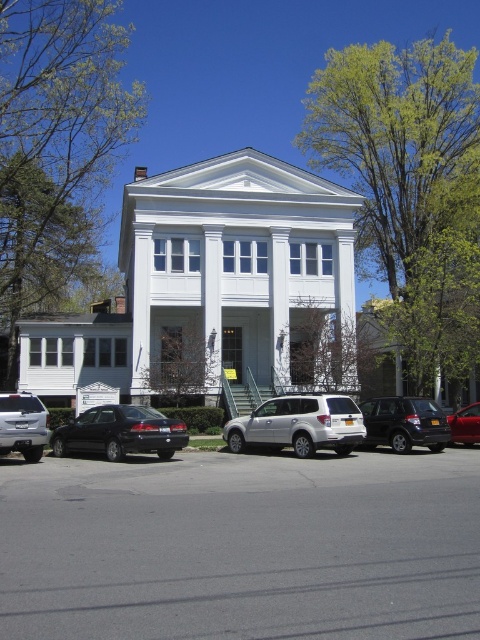
Is shiny black sedan at center above silver metallic sedan at lower left?

Incorrect, shiny black sedan at center is not positioned above silver metallic sedan at lower left.

Is shiny black sedan at center positioned before silver metallic sedan at lower left?

That is False.

Where is `shiny black sedan at center`? This screenshot has height=640, width=480. shiny black sedan at center is located at coordinates (120, 433).

Does matte black suv at lower right have a lesser width compared to silver metallic sedan at lower left?

No, matte black suv at lower right is not thinner than silver metallic sedan at lower left.

Measure the distance between point (x=387, y=435) and camera.

Point (x=387, y=435) is 63.99 feet away from camera.

Between point (396, 404) and point (0, 400), which one is positioned in front?

Point (0, 400) is more forward.

You are a GUI agent. You are given a task and a screenshot of the screen. Output one action in this format:
    pyautogui.click(x=<x>, y=<y>)
    Task: Click on the matte black suv at lower right
    
    Given the screenshot: What is the action you would take?
    pyautogui.click(x=405, y=422)

Can you confirm if shiny black sedan at center is taller than metallic red sedan at center?

Yes.

Who is more forward, (51, 433) or (453, 433)?

Point (51, 433) is more forward.

This screenshot has width=480, height=640. What are the coordinates of `shiny black sedan at center` in the screenshot? It's located at (120, 433).